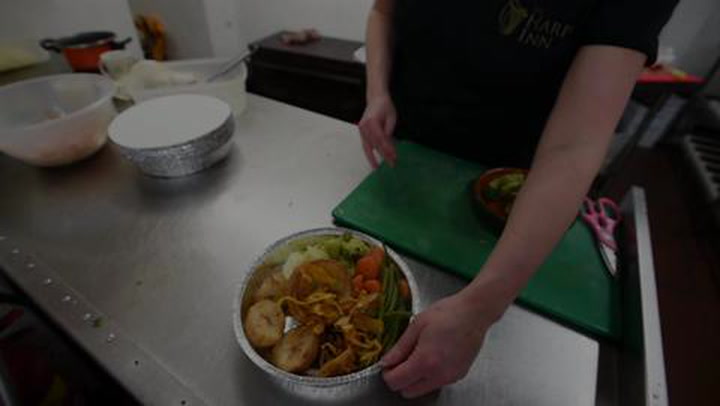
Image resolution: width=720 pixels, height=406 pixels. In order to click on kitchen range in this screenshot , I will do `click(698, 151)`.